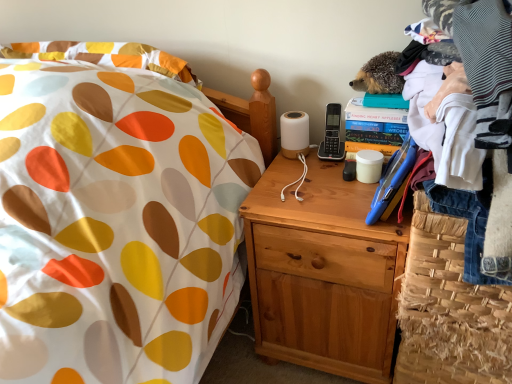
Locate an element on the screen. This screenshot has width=512, height=384. natural wood nightstand at center is located at coordinates pyautogui.click(x=323, y=271).

Where is `natural wood nightstand at center`? This screenshot has height=384, width=512. natural wood nightstand at center is located at coordinates (323, 271).

Is woven straw basket at lower right situated inside white cotton shirt at upper right or outside?

woven straw basket at lower right cannot be found inside white cotton shirt at upper right.

Is woven straw basket at lower right taller or shorter than white cotton shirt at upper right?

In the image, woven straw basket at lower right appears to be shorter than white cotton shirt at upper right.

Is white cotton shirt at upper right at the back of woven straw basket at lower right?

woven straw basket at lower right is not turned away from white cotton shirt at upper right.

From a real-world perspective, between woven straw basket at lower right and white cotton shirt at upper right, who is vertically higher?

white cotton shirt at upper right is physically above.

Consider the image. Considering the sizes of objects woven straw basket at lower right and natural wood nightstand at center in the image provided, who is thinner, woven straw basket at lower right or natural wood nightstand at center?

woven straw basket at lower right is thinner.

From a real-world perspective, is woven straw basket at lower right above or below natural wood nightstand at center?

In terms of real-world spatial position, woven straw basket at lower right is below natural wood nightstand at center.

Does woven straw basket at lower right have a smaller size compared to natural wood nightstand at center?

Correct, woven straw basket at lower right occupies less space than natural wood nightstand at center.

Is woven straw basket at lower right looking in the opposite direction of natural wood nightstand at center?

No, woven straw basket at lower right's orientation is not away from natural wood nightstand at center.

Is white cotton shirt at upper right facing away from woven straw basket at lower right?

No.

Is white cotton shirt at upper right inside or outside of woven straw basket at lower right?

white cotton shirt at upper right is spatially situated outside woven straw basket at lower right.

From a real-world perspective, which object stands above the other?

From a 3D spatial view, white cotton shirt at upper right is above.

Is natural wood nightstand at center smaller than white cotton shirt at upper right?

Incorrect, natural wood nightstand at center is not smaller in size than white cotton shirt at upper right.

Is natural wood nightstand at center not within white cotton shirt at upper right?

Yes.

From the image's perspective, is natural wood nightstand at center above white cotton shirt at upper right?

No, from the image's perspective, natural wood nightstand at center is not on top of white cotton shirt at upper right.

Which object is wider, natural wood nightstand at center or woven straw basket at lower right?

Wider between the two is natural wood nightstand at center.

From the image's perspective, is natural wood nightstand at center located above or below woven straw basket at lower right?

Based on their image positions, natural wood nightstand at center is located above woven straw basket at lower right.

Is natural wood nightstand at center positioned in front of woven straw basket at lower right?

No, natural wood nightstand at center is behind woven straw basket at lower right.

Is white cotton shirt at upper right facing towards natural wood nightstand at center?

No, white cotton shirt at upper right is not aimed at natural wood nightstand at center.

Identify the location of nightstand below the white cotton shirt at upper right (from the image's perspective). The height and width of the screenshot is (384, 512). (323, 271).

From a real-world perspective, which object rests below the other?

natural wood nightstand at center, from a real-world perspective.

Which of these two, white cotton shirt at upper right or natural wood nightstand at center, stands shorter?

With less height is white cotton shirt at upper right.

Find the location of a particular element. The image size is (512, 384). basket behind the white cotton shirt at upper right is located at coordinates (449, 309).

Identify the location of nightstand on the left of woven straw basket at lower right. The image size is (512, 384). (323, 271).

Based on their spatial positions, is white cotton shirt at upper right or woven straw basket at lower right closer to natural wood nightstand at center?

Among the two, woven straw basket at lower right is located nearer to natural wood nightstand at center.

From the image, which object appears to be nearer to white cotton shirt at upper right, natural wood nightstand at center or woven straw basket at lower right?

woven straw basket at lower right lies closer to white cotton shirt at upper right than the other object.

Estimate the real-world distances between objects in this image. Which object is further from woven straw basket at lower right, white cotton shirt at upper right or natural wood nightstand at center?

Based on the image, white cotton shirt at upper right appears to be further to woven straw basket at lower right.

Which object lies nearer to the anchor point natural wood nightstand at center, woven straw basket at lower right or white cotton shirt at upper right?

woven straw basket at lower right.

When comparing their distances from woven straw basket at lower right, does natural wood nightstand at center or white cotton shirt at upper right seem further?

white cotton shirt at upper right lies further to woven straw basket at lower right than the other object.

Considering their positions, is woven straw basket at lower right positioned further to white cotton shirt at upper right than natural wood nightstand at center?

The object further to white cotton shirt at upper right is natural wood nightstand at center.

What are the coordinates of `nightstand between white cotton shirt at upper right and woven straw basket at lower right from top to bottom` in the screenshot? It's located at (323, 271).